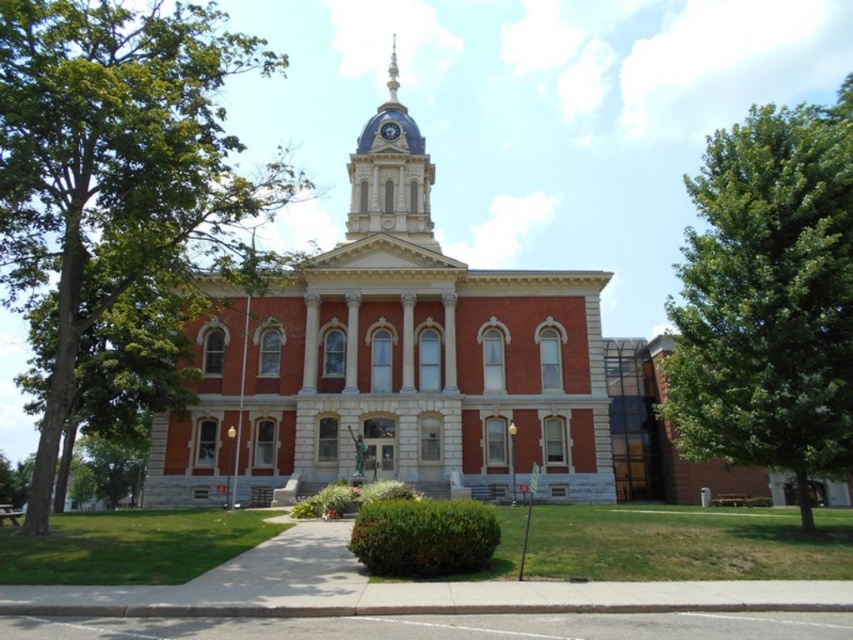
Question: Can you confirm if brick building at center is positioned below green leafy tree at left?

Choices:
 (A) no
 (B) yes

Answer: (B)

Question: Considering the real-world distances, which object is closest to the metallic gold clock at center top?

Choices:
 (A) shiny silver spire at upper center
 (B) green leafy tree at left

Answer: (A)

Question: Does green leafy tree at right appear under shiny silver spire at upper center?

Choices:
 (A) yes
 (B) no

Answer: (A)

Question: Estimate the real-world distances between objects in this image. Which object is farther from the blue domed clock tower at upper center?

Choices:
 (A) shiny silver spire at upper center
 (B) metallic gold clock at center top
 (C) green leafy tree at right
 (D) green leafy tree at left

Answer: (C)

Question: Does brick building at center appear on the right side of blue domed clock tower at upper center?

Choices:
 (A) no
 (B) yes

Answer: (B)

Question: Which of the following is the closest to the observer?

Choices:
 (A) green leafy tree at right
 (B) shiny silver spire at upper center
 (C) metallic gold clock at center top
 (D) blue domed clock tower at upper center

Answer: (A)